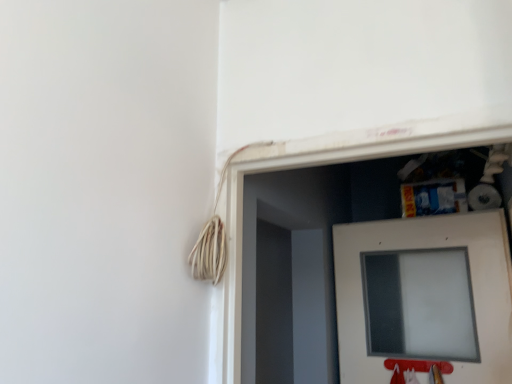
Question: In terms of size, does white matte door at center appear bigger or smaller than frosted glass window at lower right?

Choices:
 (A) big
 (B) small

Answer: (A)

Question: From a real-world perspective, is white matte door at center physically located above or below frosted glass window at lower right?

Choices:
 (A) below
 (B) above

Answer: (B)

Question: Choose the correct answer: Is white matte door at center inside frosted glass window at lower right or outside it?

Choices:
 (A) inside
 (B) outside

Answer: (B)

Question: From the image's perspective, relative to white matte door at center, is frosted glass window at lower right above or below?

Choices:
 (A) above
 (B) below

Answer: (B)

Question: From a real-world perspective, is frosted glass window at lower right above or below white matte door at center?

Choices:
 (A) above
 (B) below

Answer: (B)

Question: Relative to white matte door at center, is frosted glass window at lower right in front or behind?

Choices:
 (A) behind
 (B) front

Answer: (A)

Question: Would you say frosted glass window at lower right is to the left or to the right of white matte door at center in the picture?

Choices:
 (A) right
 (B) left

Answer: (B)